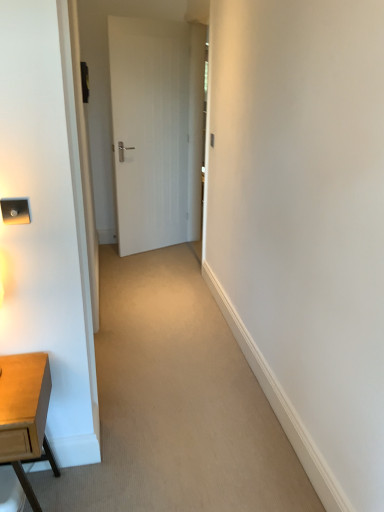
Find the location of a particular element. This screenshot has width=384, height=512. free spot to the right of light brown wooden desk at lower left is located at coordinates (109, 485).